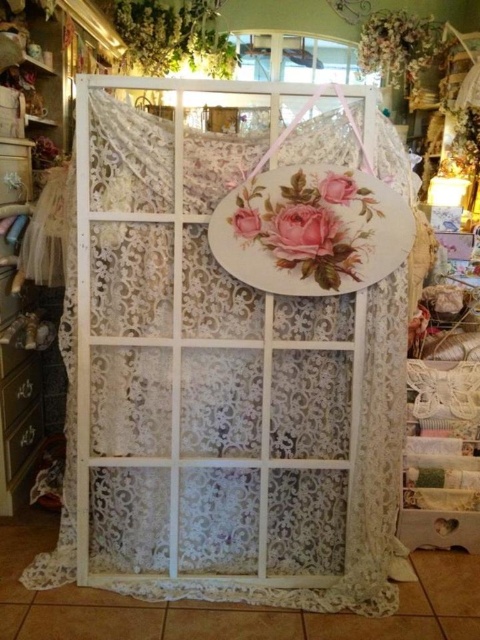
You are a customer in the shop and want to place a small gift card on the display. If you want the gift card to be closer to the left side of the display, should you place it near the matte pink rose at center or the matte pink floral panel at center?

The matte pink rose at center is to the right of the matte pink floral panel at center. To place the gift card closer to the left side of the display, you should place it near the matte pink floral panel at center.

You are a customer in the shop and want to know which object is bigger between the white lace curtain at center and the matte pink floral at center. Can you tell me?

The white lace curtain at center has a larger size compared to the matte pink floral at center, so the white lace curtain at center is bigger.